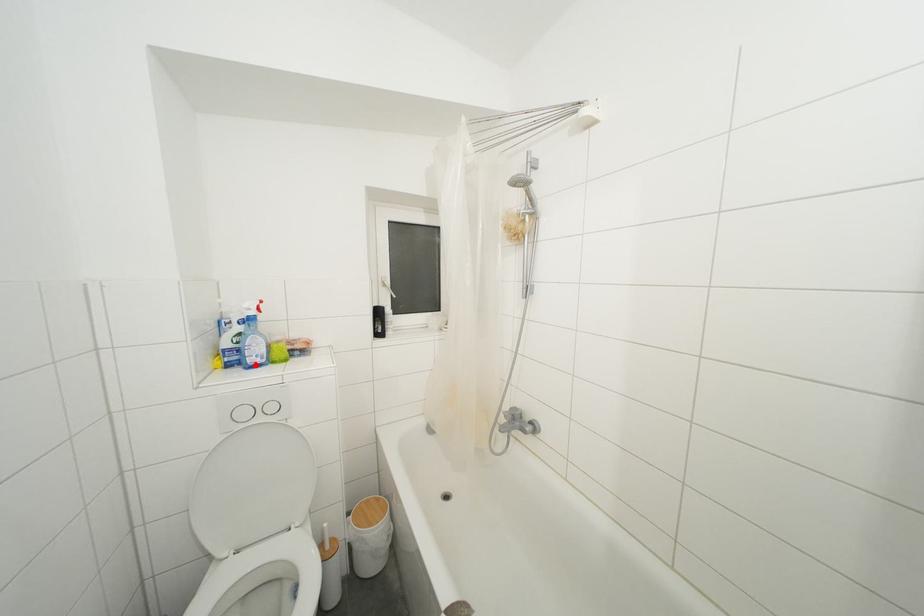
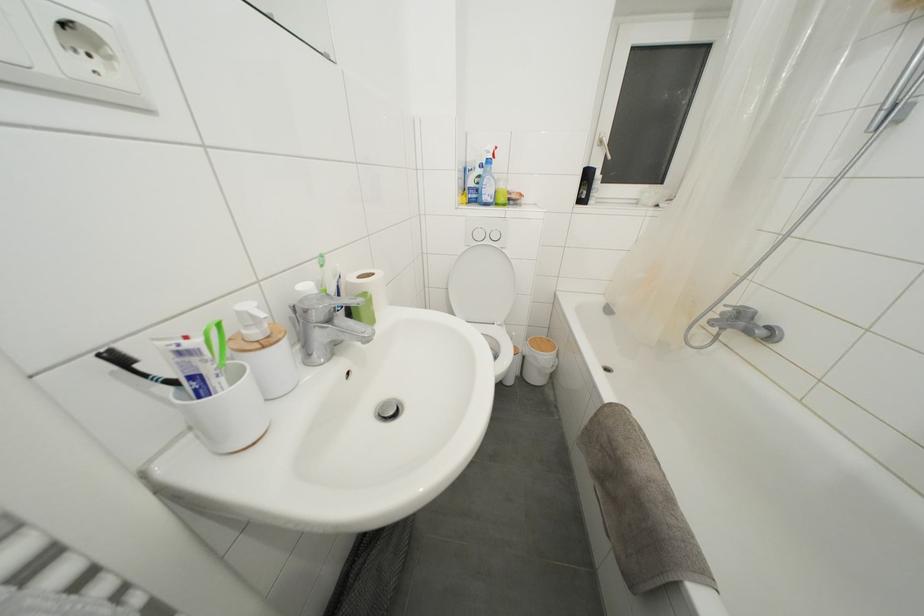
Question: A red point is marked in image1. In image2, is the corresponding 3D point closer to the camera or farther? Reply with the corresponding letter.

Choices:
 (A) The corresponding 3D point is closer.
 (B) The corresponding 3D point is farther.

Answer: (A)